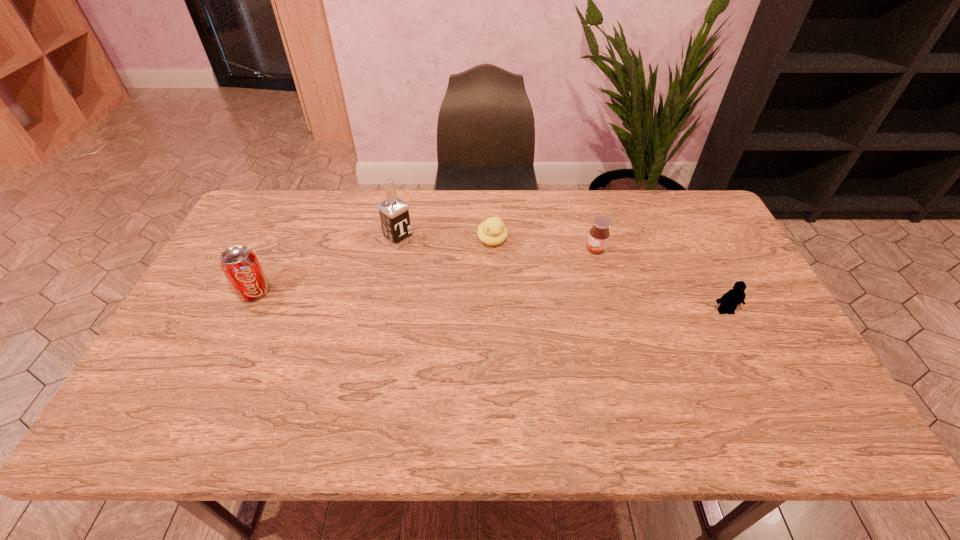
You are a GUI agent. You are given a task and a screenshot of the screen. Output one action in this format:
    pyautogui.click(x=<x>, y=<y>)
    Task: Click on the vacant point located 0.070m on the face of the nearest object
    Image resolution: width=960 pixels, height=540 pixels.
    Given the screenshot: What is the action you would take?
    pyautogui.click(x=737, y=336)

Identify the location of free space located 0.230m on the front label of the tallest object. pos(459,284).

This screenshot has width=960, height=540. Find the location of `free space located 0.130m on the front label of the tallest object`. free space located 0.130m on the front label of the tallest object is located at coordinates (436, 267).

I want to click on free space located 0.160m on the front label of the tallest object, so click(x=443, y=272).

Where is `free space located on the label side of the fourth object from left to right`? free space located on the label side of the fourth object from left to right is located at coordinates (482, 294).

This screenshot has width=960, height=540. Identify the location of vacant space located 0.170m on the label side of the fourth object from left to right. coord(541,271).

In order to click on vacant space situated on the label side of the fourth object from left to right in this screenshot , I will do `click(510, 283)`.

You are a GUI agent. You are given a task and a screenshot of the screen. Output one action in this format:
    pyautogui.click(x=<x>, y=<y>)
    Task: Click on the free space located 0.070m at the beak of the third object from right to left
    
    Given the screenshot: What is the action you would take?
    pos(501,267)

The image size is (960, 540). Find the location of `vacant position located at the beak of the third object from right to left`. vacant position located at the beak of the third object from right to left is located at coordinates (500, 265).

The image size is (960, 540). I want to click on vacant space located 0.110m at the beak of the third object from right to left, so click(504, 276).